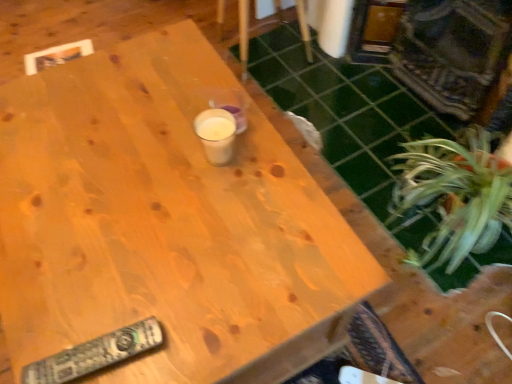
Question: Is green leafy plant at lower right behind wooden chair at upper center?

Choices:
 (A) yes
 (B) no

Answer: (B)

Question: Can we say green leafy plant at lower right lies outside wooden chair at upper center?

Choices:
 (A) no
 (B) yes

Answer: (B)

Question: From a real-world perspective, is green leafy plant at lower right physically above wooden chair at upper center?

Choices:
 (A) yes
 (B) no

Answer: (B)

Question: Does green leafy plant at lower right have a larger size compared to wooden chair at upper center?

Choices:
 (A) no
 (B) yes

Answer: (A)

Question: Is green leafy plant at lower right to the left of wooden chair at upper center from the viewer's perspective?

Choices:
 (A) yes
 (B) no

Answer: (B)

Question: From the image's perspective, relative to green leafy plant at lower right, is wooden table at center above or below?

Choices:
 (A) above
 (B) below

Answer: (B)

Question: From a real-world perspective, is wooden table at center positioned above or below green leafy plant at lower right?

Choices:
 (A) above
 (B) below

Answer: (A)

Question: Is point (292, 350) closer or farther from the camera than point (448, 216)?

Choices:
 (A) farther
 (B) closer

Answer: (B)

Question: Is wooden table at center in front of or behind green leafy plant at lower right in the image?

Choices:
 (A) behind
 (B) front

Answer: (B)

Question: From a real-world perspective, is green leafy plant at lower right above or below black plastic remote at lower left?

Choices:
 (A) below
 (B) above

Answer: (A)

Question: From their relative heights in the image, would you say green leafy plant at lower right is taller or shorter than black plastic remote at lower left?

Choices:
 (A) tall
 (B) short

Answer: (A)

Question: Considering the positions of point (431, 139) and point (126, 349), is point (431, 139) closer or farther from the camera than point (126, 349)?

Choices:
 (A) farther
 (B) closer

Answer: (A)

Question: Looking at their shapes, would you say green leafy plant at lower right is wider or thinner than black plastic remote at lower left?

Choices:
 (A) wide
 (B) thin

Answer: (B)

Question: Based on their sizes in the image, would you say black plastic remote at lower left is bigger or smaller than wooden table at center?

Choices:
 (A) small
 (B) big

Answer: (A)

Question: Does point (93, 349) appear closer or farther from the camera than point (139, 180)?

Choices:
 (A) farther
 (B) closer

Answer: (B)